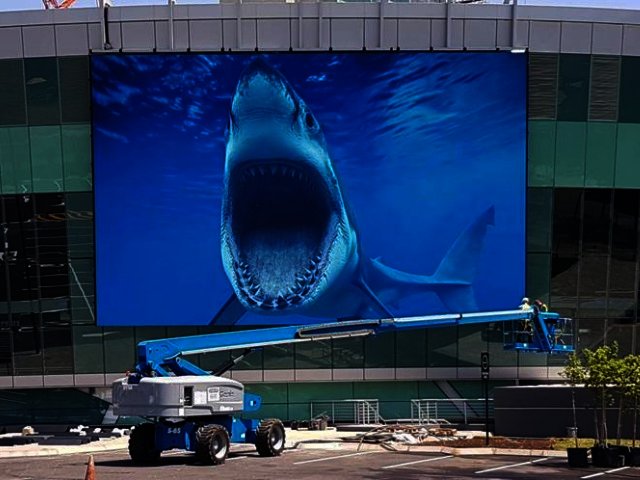
You are a GUI agent. You are given a task and a screenshot of the screen. Output one action in this format:
    pyautogui.click(x=<x>, y=<y>)
    Task: Click on the screen
    
    Given the screenshot: What is the action you would take?
    pyautogui.click(x=513, y=178)